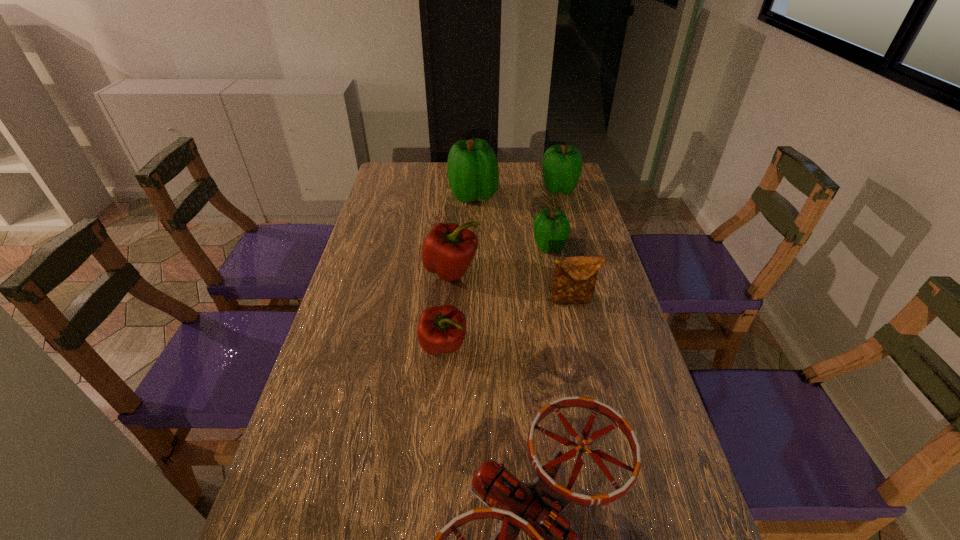
This screenshot has height=540, width=960. Identify the location of bell pepper that is the nearest to the farther pink bell pepper. (441, 329).

Locate which green bell pepper ranks second in proximity to the nearest bell pepper. Please provide its 2D coordinates. Your answer should be formatted as a tuple, i.e. [(x, y)], where the tuple contains the x and y coordinates of a point satisfying the conditions above.

[(472, 167)]

I want to click on green bell pepper that is the closest to the red drone, so click(x=551, y=228).